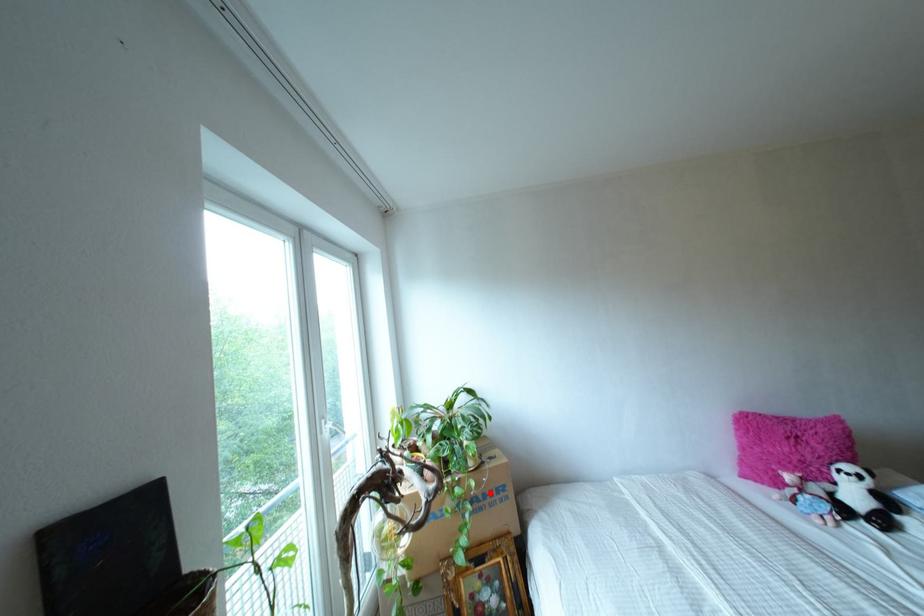
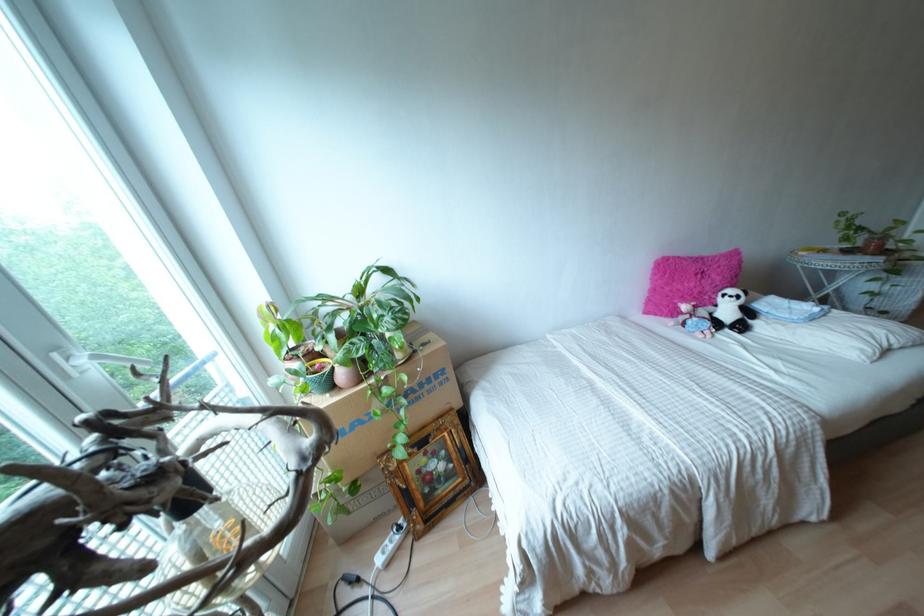
Where in the second image is the point corresponding to the highlighted location from the first image?

(428, 379)